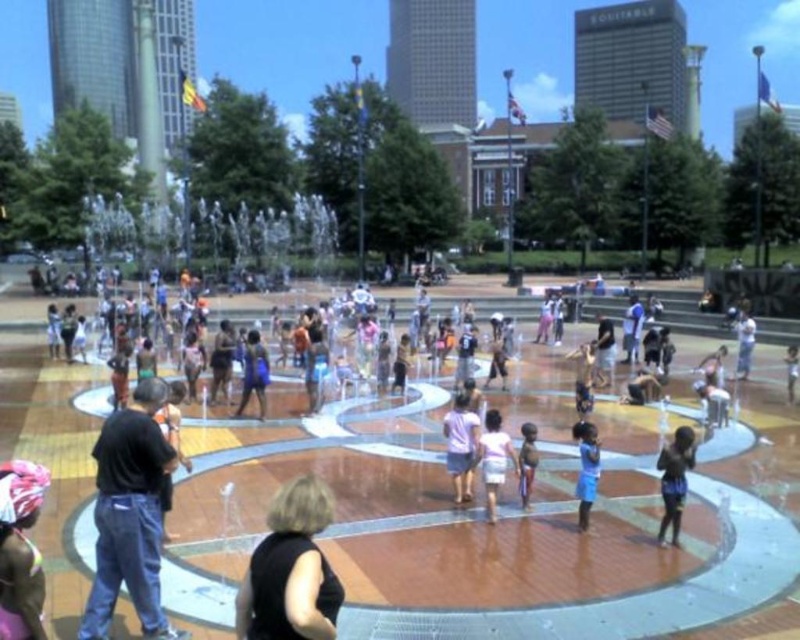
From the picture: You are standing at the edge of the fountain and see the black cotton shirt at lower left and the matte pink headscarf at lower left. Which one is closer to you?

The black cotton shirt at lower left is closer to you because the matte pink headscarf at lower left is behind it.

You are a photographer trying to capture a candid shot of both the black cotton shirt at lower left and the matte pink headscarf at lower left. If you want to ensure both subjects are fully visible in the frame, which one should you position closer to the center of the photo?

You should position the black cotton shirt at lower left closer to the center of the photo because it might be wider than the matte pink headscarf at lower left, ensuring it fits within the frame.

You are a photographer trying to capture a clear shot of both the matte pink headscarf at lower left and the blue fabric shirt at center. Since you want to ensure both are visible in your photo, which object should you focus on first to account for their sizes?

You should focus on the matte pink headscarf at lower left first because it is larger in size than the blue fabric shirt at center, making it more prominent and easier to capture clearly.